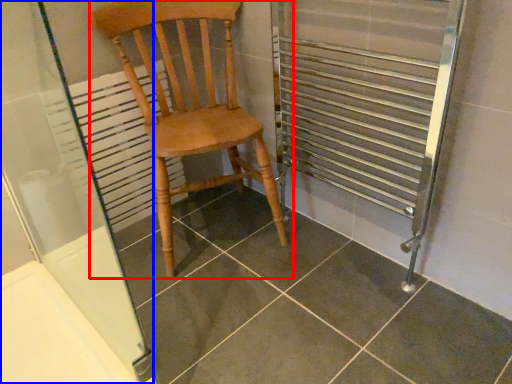
Question: Which of the following is the closest to the observer, chair (highlighted by a red box) or screen door (highlighted by a blue box)?

Choices:
 (A) chair
 (B) screen door

Answer: (B)